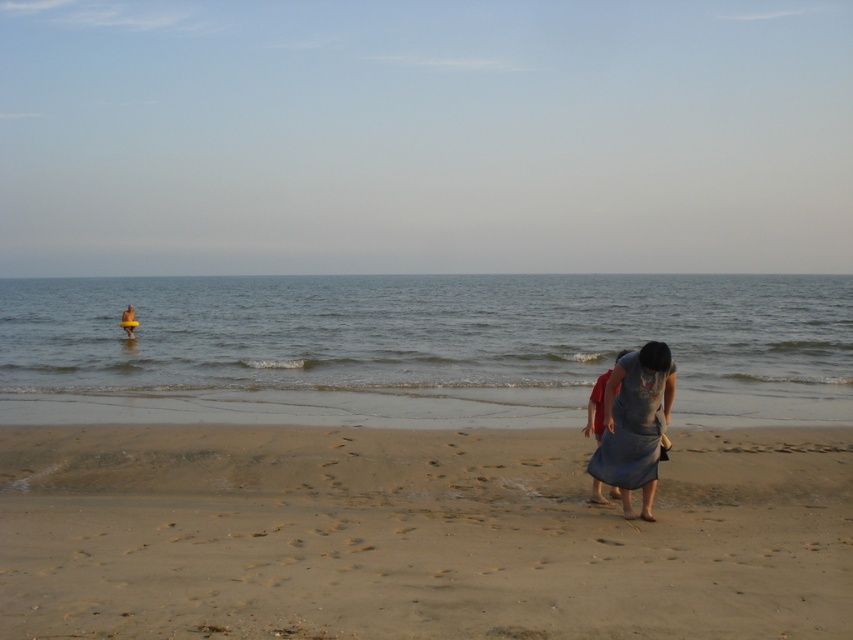
You are standing on the beach and see the clear blue water at center and the denim dress at lower right. Which object is closer to you?

The denim dress at lower right is behind the clear blue water at center, so the clear blue water at center is closer to you.

You are standing on the beach and want to locate the clear blue water at center. Based on your position, which direction should you face to see it?

You should face the center direction to see the clear blue water at center located at point coordinates (422, 332).